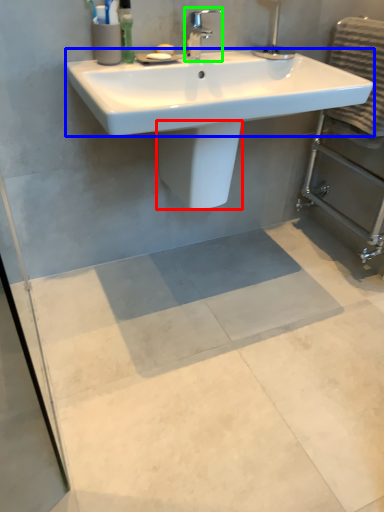
Question: Which is nearer to the bidet (highlighted by a red box)? counter top (highlighted by a blue box) or tap (highlighted by a green box).

Choices:
 (A) counter top
 (B) tap

Answer: (A)